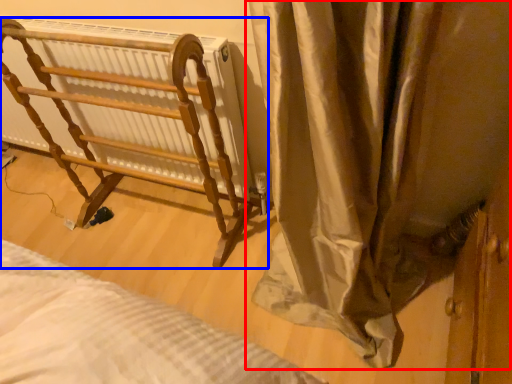
Question: Which point is further to the camera, curtain (highlighted by a red box) or furniture (highlighted by a blue box)?

Choices:
 (A) curtain
 (B) furniture

Answer: (B)